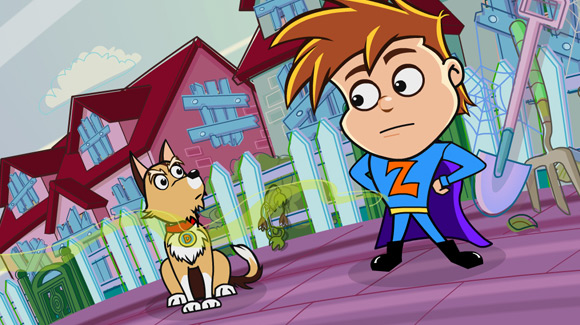
At what (x,y) coordinates should I click in order to perform the action: click on cobweb. Please return your answer as a coordinate pair (x, y). Looking at the image, I should click on (482, 95).